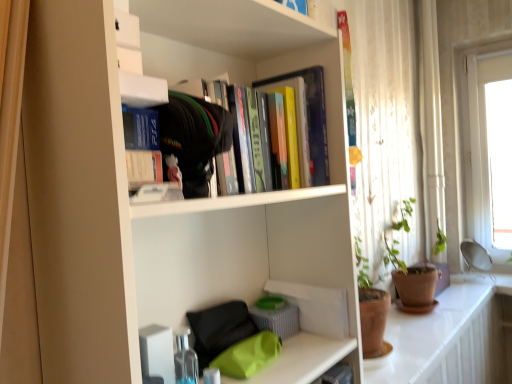
Question: Is matte black ps4 case at upper center, which appears as the 2th book when viewed from the right, smaller than white matte paperback book at upper center?

Choices:
 (A) no
 (B) yes

Answer: (A)

Question: Is matte black ps4 case at upper center, which is counted as the first book, starting from the left, behind white matte paperback book at upper center?

Choices:
 (A) no
 (B) yes

Answer: (B)

Question: From a real-world perspective, is matte black ps4 case at upper center, which is counted as the 2th book, starting from the back, located beneath white matte paperback book at upper center?

Choices:
 (A) yes
 (B) no

Answer: (B)

Question: Considering the relative positions of matte black ps4 case at upper center, which is counted as the 2th book, starting from the back, and white matte paperback book at upper center in the image provided, is matte black ps4 case at upper center, which is counted as the 2th book, starting from the back, to the left of white matte paperback book at upper center from the viewer's perspective?

Choices:
 (A) yes
 (B) no

Answer: (A)

Question: Could you tell me if matte black ps4 case at upper center, which is counted as the first book, starting from the left, is facing white matte paperback book at upper center?

Choices:
 (A) yes
 (B) no

Answer: (B)

Question: Considering the positions of matte gray basket at center and white glossy counter top at lower right in the image, is matte gray basket at center bigger or smaller than white glossy counter top at lower right?

Choices:
 (A) big
 (B) small

Answer: (B)

Question: Is point (267, 329) positioned closer to the camera than point (457, 332)?

Choices:
 (A) closer
 (B) farther

Answer: (A)

Question: In the image, is matte gray basket at center positioned in front of or behind white glossy counter top at lower right?

Choices:
 (A) front
 (B) behind

Answer: (A)

Question: From the image's perspective, is matte gray basket at center above or below white glossy counter top at lower right?

Choices:
 (A) below
 (B) above

Answer: (B)

Question: From a real-world perspective, is matte black ps4 case at upper center, which appears as the 2th book when viewed from the right, physically located above or below hardcover books at upper center, arranged as the 1th book when viewed from the back?

Choices:
 (A) above
 (B) below

Answer: (B)

Question: Is matte black ps4 case at upper center, which is counted as the first book, starting from the left, in front of or behind hardcover books at upper center, arranged as the 1th book when viewed from the back, in the image?

Choices:
 (A) front
 (B) behind

Answer: (A)

Question: From their relative heights in the image, would you say matte black ps4 case at upper center, which is counted as the first book, starting from the left, is taller or shorter than hardcover books at upper center, arranged as the 1th book when viewed from the back?

Choices:
 (A) short
 (B) tall

Answer: (A)

Question: In the image, is matte black ps4 case at upper center, which is counted as the first book, starting from the front, on the left side or the right side of hardcover books at upper center, positioned as the first book in right-to-left order?

Choices:
 (A) right
 (B) left

Answer: (B)

Question: From the image's perspective, is white glossy counter top at lower right positioned above or below matte gray basket at center?

Choices:
 (A) above
 (B) below

Answer: (B)

Question: Does point (379, 375) appear closer or farther from the camera than point (287, 314)?

Choices:
 (A) closer
 (B) farther

Answer: (B)